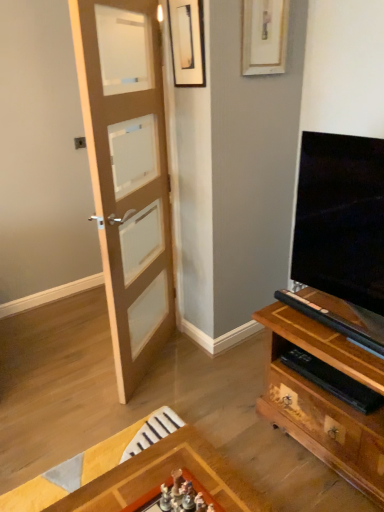
This screenshot has height=512, width=384. What are the coordinates of `light brown wooden door at left` in the screenshot? It's located at (128, 174).

What do you see at coordinates (187, 42) in the screenshot?
I see `matte black picture frame at upper center, the 1th picture frame in the left-to-right sequence` at bounding box center [187, 42].

I want to click on light brown wooden door at left, so click(x=128, y=174).

From a real-world perspective, is matte black picture frame at upper center, the 1th picture frame in the left-to-right sequence, located higher than light brown wooden door at left?

Yes, from a real-world perspective, matte black picture frame at upper center, the 1th picture frame in the left-to-right sequence, is over light brown wooden door at left

Considering the relative positions of matte black picture frame at upper center, the 1th picture frame in the left-to-right sequence, and light brown wooden door at left in the image provided, is matte black picture frame at upper center, the 1th picture frame in the left-to-right sequence, to the left or to the right of light brown wooden door at left?

From the image, it's evident that matte black picture frame at upper center, the 1th picture frame in the left-to-right sequence, is to the right of light brown wooden door at left.

Does matte black picture frame at upper center, the 2th picture frame when ordered from right to left, have a lesser width compared to light brown wooden door at left?

Yes, matte black picture frame at upper center, the 2th picture frame when ordered from right to left, is thinner than light brown wooden door at left.

Is the position of matte black picture frame at upper center, the 2th picture frame when ordered from right to left, less distant than that of light brown wooden door at left?

No.

Is matte black picture frame at upper center, the 1th picture frame in the left-to-right sequence, taller than wooden picture frame at upper center, which appears as the 2th picture frame when viewed from the left?

Incorrect, the height of matte black picture frame at upper center, the 1th picture frame in the left-to-right sequence, is not larger of that of wooden picture frame at upper center, which appears as the 2th picture frame when viewed from the left.

Find the location of `picture frame on the left side of wooden picture frame at upper center, the first picture frame when ordered from right to left`. picture frame on the left side of wooden picture frame at upper center, the first picture frame when ordered from right to left is located at coordinates (187, 42).

How far apart are matte black picture frame at upper center, the 1th picture frame in the left-to-right sequence, and wooden picture frame at upper center, which appears as the 2th picture frame when viewed from the left?

matte black picture frame at upper center, the 1th picture frame in the left-to-right sequence, and wooden picture frame at upper center, which appears as the 2th picture frame when viewed from the left, are 11.98 inches apart.

Are matte black picture frame at upper center, the 2th picture frame when ordered from right to left, and wooden picture frame at upper center, the first picture frame when ordered from right to left, located far from each other?

No.

Is wooden picture frame at upper center, which appears as the 2th picture frame when viewed from the left, facing away from matte black picture frame at upper center, the 1th picture frame in the left-to-right sequence?

No, matte black picture frame at upper center, the 1th picture frame in the left-to-right sequence, is not at the back of wooden picture frame at upper center, which appears as the 2th picture frame when viewed from the left.

Can you tell me how much wooden picture frame at upper center, the first picture frame when ordered from right to left, and matte black picture frame at upper center, the 2th picture frame when ordered from right to left, differ in facing direction?

The facing directions of wooden picture frame at upper center, the first picture frame when ordered from right to left, and matte black picture frame at upper center, the 2th picture frame when ordered from right to left, are 91.8 degrees apart.

Are wooden picture frame at upper center, the first picture frame when ordered from right to left, and matte black picture frame at upper center, the 2th picture frame when ordered from right to left, located far from each other?

No, there isn't a large distance between wooden picture frame at upper center, the first picture frame when ordered from right to left, and matte black picture frame at upper center, the 2th picture frame when ordered from right to left.

Does wooden picture frame at upper center, which appears as the 2th picture frame when viewed from the left, have a lesser width compared to matte black picture frame at upper center, the 2th picture frame when ordered from right to left?

Yes, wooden picture frame at upper center, which appears as the 2th picture frame when viewed from the left, is thinner than matte black picture frame at upper center, the 2th picture frame when ordered from right to left.

Find the location of `door on the left of wooden picture frame at upper center, which appears as the 2th picture frame when viewed from the left`. door on the left of wooden picture frame at upper center, which appears as the 2th picture frame when viewed from the left is located at coordinates (128, 174).

Relative to light brown wooden door at left, is wooden picture frame at upper center, the first picture frame when ordered from right to left, in front or behind?

In the image, wooden picture frame at upper center, the first picture frame when ordered from right to left, appears behind light brown wooden door at left.

From the image's perspective, would you say wooden picture frame at upper center, the first picture frame when ordered from right to left, is positioned over light brown wooden door at left?

Yes, from the image's perspective, wooden picture frame at upper center, the first picture frame when ordered from right to left, is on top of light brown wooden door at left.

From the picture: Is wooden picture frame at upper center, the first picture frame when ordered from right to left, at the back of light brown wooden door at left?

Correct, light brown wooden door at left is looking away from wooden picture frame at upper center, the first picture frame when ordered from right to left.

From the image's perspective, is light brown wooden door at left located above or below wooden picture frame at upper center, the first picture frame when ordered from right to left?

Based on their image positions, light brown wooden door at left is located beneath wooden picture frame at upper center, the first picture frame when ordered from right to left.

Between light brown wooden door at left and wooden picture frame at upper center, the first picture frame when ordered from right to left, which one has larger size?

light brown wooden door at left is bigger.

From the image's perspective, starting from the light brown wooden door at left, which picture frame is the 2nd one above? Please provide its 2D coordinates.

[(264, 36)]

Which of these two, light brown wooden door at left or matte black picture frame at upper center, the 2th picture frame when ordered from right to left, is bigger?

With larger size is light brown wooden door at left.

Who is taller, light brown wooden door at left or matte black picture frame at upper center, the 2th picture frame when ordered from right to left?

light brown wooden door at left.

From the image's perspective, is light brown wooden door at left on matte black picture frame at upper center, the 2th picture frame when ordered from right to left?

Actually, light brown wooden door at left appears below matte black picture frame at upper center, the 2th picture frame when ordered from right to left, in the image.

Is light brown wooden door at left far from matte black picture frame at upper center, the 1th picture frame in the left-to-right sequence?

Actually, light brown wooden door at left and matte black picture frame at upper center, the 1th picture frame in the left-to-right sequence, are a little close together.

Where is `door that appears below the matte black picture frame at upper center, the 2th picture frame when ordered from right to left (from the image's perspective)`? door that appears below the matte black picture frame at upper center, the 2th picture frame when ordered from right to left (from the image's perspective) is located at coordinates (128, 174).

You are a GUI agent. You are given a task and a screenshot of the screen. Output one action in this format:
    pyautogui.click(x=<x>, y=<y>)
    Task: Click on the picture frame below the wooden picture frame at upper center, the first picture frame when ordered from right to left (from a real-world perspective)
    The width and height of the screenshot is (384, 512).
    Given the screenshot: What is the action you would take?
    pyautogui.click(x=187, y=42)

Based on their spatial positions, is light brown wooden door at left or wooden picture frame at upper center, the first picture frame when ordered from right to left, closer to matte black picture frame at upper center, the 2th picture frame when ordered from right to left?

wooden picture frame at upper center, the first picture frame when ordered from right to left, is closer to matte black picture frame at upper center, the 2th picture frame when ordered from right to left.

Which object lies nearer to the anchor point wooden picture frame at upper center, the first picture frame when ordered from right to left, light brown wooden door at left or matte black picture frame at upper center, the 2th picture frame when ordered from right to left?

Based on the image, matte black picture frame at upper center, the 2th picture frame when ordered from right to left, appears to be nearer to wooden picture frame at upper center, the first picture frame when ordered from right to left.

Based on their spatial positions, is wooden picture frame at upper center, which appears as the 2th picture frame when viewed from the left, or light brown wooden door at left further from matte black picture frame at upper center, the 2th picture frame when ordered from right to left?

Among the two, light brown wooden door at left is located further to matte black picture frame at upper center, the 2th picture frame when ordered from right to left.

From the image, which object appears to be nearer to wooden picture frame at upper center, which appears as the 2th picture frame when viewed from the left, matte black picture frame at upper center, the 1th picture frame in the left-to-right sequence, or light brown wooden door at left?

Among the two, matte black picture frame at upper center, the 1th picture frame in the left-to-right sequence, is located nearer to wooden picture frame at upper center, which appears as the 2th picture frame when viewed from the left.

Looking at this image, considering their positions, is matte black picture frame at upper center, the 2th picture frame when ordered from right to left, positioned further to light brown wooden door at left than wooden picture frame at upper center, the first picture frame when ordered from right to left?

wooden picture frame at upper center, the first picture frame when ordered from right to left, lies further to light brown wooden door at left than the other object.

Estimate the real-world distances between objects in this image. Which object is closer to light brown wooden door at left, wooden picture frame at upper center, which appears as the 2th picture frame when viewed from the left, or matte black picture frame at upper center, the 1th picture frame in the left-to-right sequence?

Among the two, matte black picture frame at upper center, the 1th picture frame in the left-to-right sequence, is located nearer to light brown wooden door at left.

At what (x,y) coordinates should I click in order to perform the action: click on picture frame between wooden picture frame at upper center, the first picture frame when ordered from right to left, and light brown wooden door at left, in the vertical direction. Please return your answer as a coordinate pair (x, y). The image size is (384, 512). Looking at the image, I should click on (187, 42).